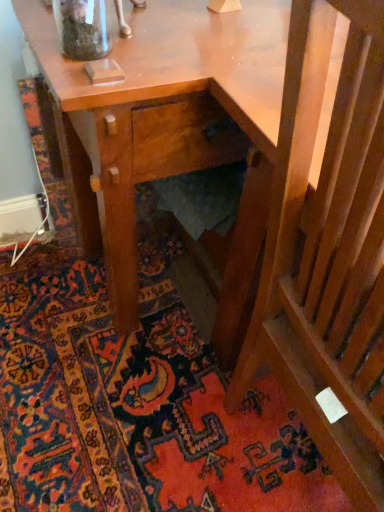
The height and width of the screenshot is (512, 384). Identify the location of carpeted stairs at lower right. (135, 406).

You are a GUI agent. You are given a task and a screenshot of the screen. Output one action in this format:
    pyautogui.click(x=<x>, y=<y>)
    Task: Click on the clear glass jar at upper left
    The width and height of the screenshot is (384, 512).
    Given the screenshot: What is the action you would take?
    pyautogui.click(x=83, y=28)

Find the location of `wooden slats at lower right`. wooden slats at lower right is located at coordinates (328, 245).

How different are the orientations of clear glass jar at upper left and wooden slats at lower right in degrees?

clear glass jar at upper left and wooden slats at lower right are facing 90 degrees away from each other.

Consider the image. Does clear glass jar at upper left have a greater width compared to wooden slats at lower right?

No.

Looking at this image, which is less distant, (60,4) or (335,291)?

Point (60,4) is farther from the camera than point (335,291).

Is clear glass jar at upper left to the right of wooden slats at lower right from the viewer's perspective?

No.

The height and width of the screenshot is (512, 384). Identify the location of glass vase above the wooden slats at lower right (from a real-world perspective). pyautogui.click(x=83, y=28).

In the scene shown: Who is taller, wooden slats at lower right or clear glass jar at upper left?

Standing taller between the two is wooden slats at lower right.

Looking at this image, does wooden slats at lower right lie in front of clear glass jar at upper left?

That is True.

From a real-world perspective, is wooden slats at lower right located higher than clear glass jar at upper left?

No, from a real-world perspective, wooden slats at lower right is not above clear glass jar at upper left.

Could you tell me if carpeted stairs at lower right is facing clear glass jar at upper left?

No, carpeted stairs at lower right does not turn towards clear glass jar at upper left.

Which is closer to the camera, (148, 250) or (93, 50)?

Clearly, point (148, 250) is more distant from the camera than point (93, 50).

Is carpeted stairs at lower right next to clear glass jar at upper left and touching it?

carpeted stairs at lower right and clear glass jar at upper left are clearly separated.

Is carpeted stairs at lower right to the right of clear glass jar at upper left from the viewer's perspective?

Incorrect, carpeted stairs at lower right is not on the right side of clear glass jar at upper left.

From the image's perspective, which is below, clear glass jar at upper left or carpeted stairs at lower right?

carpeted stairs at lower right is shown below in the image.

Which of these two, clear glass jar at upper left or carpeted stairs at lower right, is wider?

carpeted stairs at lower right.

Between point (92, 0) and point (58, 348), which one is positioned behind?

The point (58, 348) is behind.

Identify the location of mat beneath the clear glass jar at upper left (from a real-world perspective). This screenshot has width=384, height=512. (135, 406).

Does carpeted stairs at lower right have a greater width compared to wooden slats at lower right?

Yes, carpeted stairs at lower right is wider than wooden slats at lower right.

Is carpeted stairs at lower right bigger than wooden slats at lower right?

No, carpeted stairs at lower right is not bigger than wooden slats at lower right.

From a real-world perspective, is carpeted stairs at lower right located beneath wooden slats at lower right?

Correct, in the physical world, carpeted stairs at lower right is lower than wooden slats at lower right.

Looking at this image, from the image's perspective, is carpeted stairs at lower right above wooden slats at lower right?

Actually, carpeted stairs at lower right appears below wooden slats at lower right in the image.

Considering the relative sizes of wooden slats at lower right and carpeted stairs at lower right in the image provided, is wooden slats at lower right taller than carpeted stairs at lower right?

Yes.

Is wooden slats at lower right positioned far away from carpeted stairs at lower right?

No, wooden slats at lower right is not far from carpeted stairs at lower right.

At what (x,y) coordinates should I click in order to perform the action: click on mat on the left of the wooden slats at lower right. Please return your answer as a coordinate pair (x, y). This screenshot has height=512, width=384. Looking at the image, I should click on (135, 406).

Locate an element on the screen. glass vase lying on the left of wooden slats at lower right is located at coordinates (83, 28).

Where is `rocking chair below the clear glass jar at upper left (from a real-world perspective)`? Image resolution: width=384 pixels, height=512 pixels. rocking chair below the clear glass jar at upper left (from a real-world perspective) is located at coordinates (328, 245).

Based on their spatial positions, is clear glass jar at upper left or wooden slats at lower right closer to carpeted stairs at lower right?

wooden slats at lower right is closer to carpeted stairs at lower right.

Estimate the real-world distances between objects in this image. Which object is closer to clear glass jar at upper left, wooden slats at lower right or carpeted stairs at lower right?

The object closer to clear glass jar at upper left is wooden slats at lower right.

From the image, which object appears to be farther from carpeted stairs at lower right, wooden slats at lower right or clear glass jar at upper left?

clear glass jar at upper left lies further to carpeted stairs at lower right than the other object.

Based on the photo, considering their positions, is carpeted stairs at lower right positioned closer to wooden slats at lower right than clear glass jar at upper left?

carpeted stairs at lower right lies closer to wooden slats at lower right than the other object.

Which object lies nearer to the anchor point wooden slats at lower right, clear glass jar at upper left or carpeted stairs at lower right?

Based on the image, carpeted stairs at lower right appears to be nearer to wooden slats at lower right.

Consider the image. Looking at the image, which one is located further to clear glass jar at upper left, carpeted stairs at lower right or wooden slats at lower right?

The object further to clear glass jar at upper left is carpeted stairs at lower right.

The height and width of the screenshot is (512, 384). I want to click on rocking chair between clear glass jar at upper left and carpeted stairs at lower right vertically, so click(x=328, y=245).